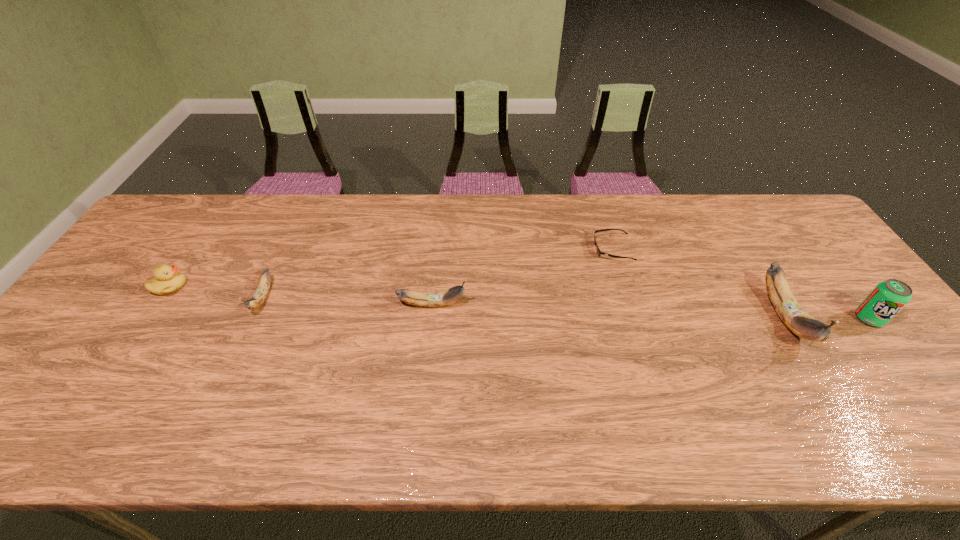
What are the coordinates of `pop soda` in the screenshot? It's located at (888, 297).

Where is `vacant space located 0.090m on the peel of the shortest banana`? The height and width of the screenshot is (540, 960). vacant space located 0.090m on the peel of the shortest banana is located at coordinates (240, 348).

In order to click on vacant space located on the peel of the fourth shortest object in this screenshot , I will do `click(530, 304)`.

The image size is (960, 540). Find the location of `free spot located 0.060m on the peel of the rightmost banana`. free spot located 0.060m on the peel of the rightmost banana is located at coordinates click(x=824, y=381).

Locate an element on the screen. vacant point located 0.260m on the front-facing side of the sunglasses is located at coordinates (508, 249).

Locate an element on the screen. free location located on the front-facing side of the sunglasses is located at coordinates pos(492,249).

Locate an element on the screen. The height and width of the screenshot is (540, 960). blank space located 0.070m on the front-facing side of the sunglasses is located at coordinates (570, 249).

Where is `free space located on the beak of the leftmost object`? free space located on the beak of the leftmost object is located at coordinates (303, 286).

Where is `vacant space situated on the front-facing side of the second tallest object`? The width and height of the screenshot is (960, 540). vacant space situated on the front-facing side of the second tallest object is located at coordinates (890, 345).

Locate an element on the screen. object at the far edge is located at coordinates (598, 251).